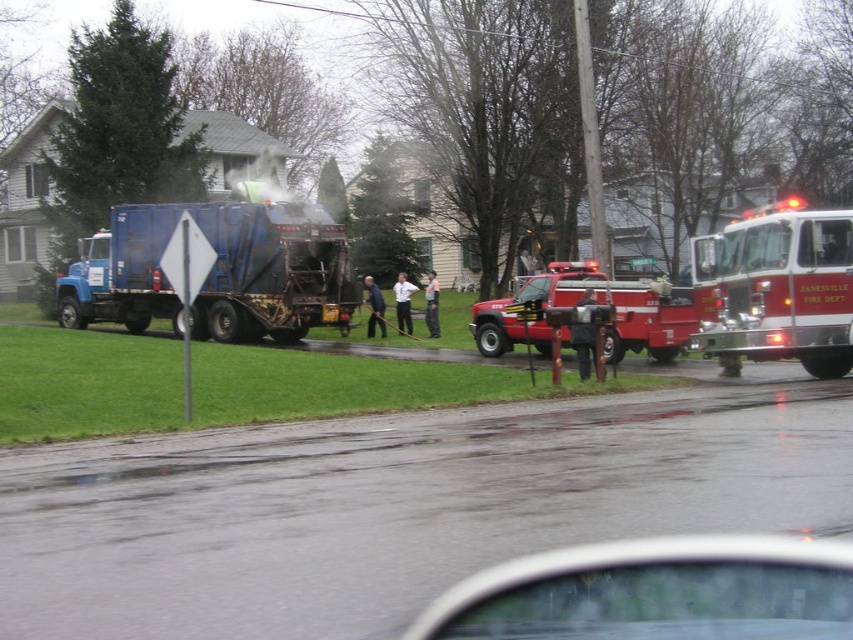
You are driving a delivery van and need to pass by the clear glass windshield at center and the blue metallic garbage truck at left. Based on their sizes, which one do you think you can see more of in your side mirror as you drive past them?

The clear glass windshield at center has a smaller size compared to the blue metallic garbage truck at left, so you will see more of the blue metallic garbage truck at left in your side mirror as you drive past them.